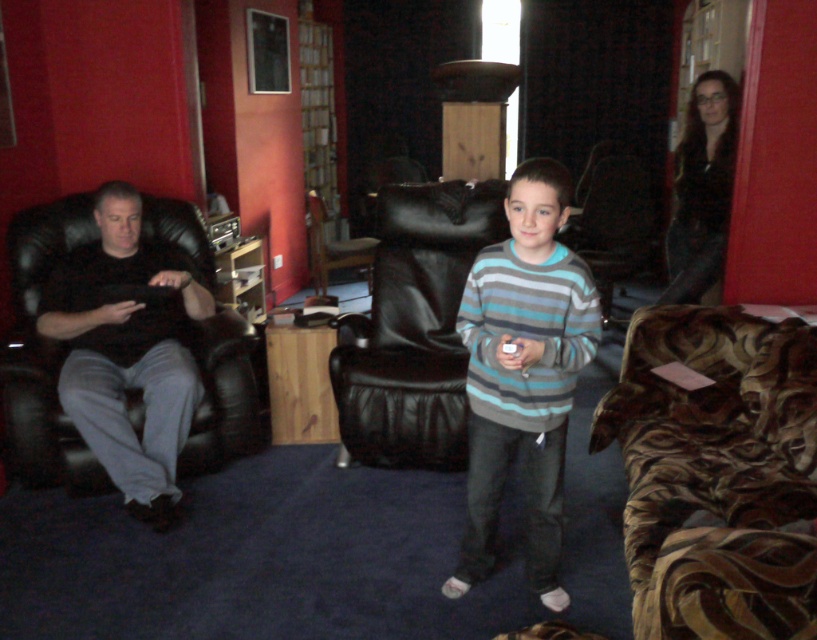
Question: Among these objects, which one is farthest from the camera?

Choices:
 (A) striped sweater at center
 (B) black leather chair at left
 (C) brown velvety couch at lower right
 (D) black leather chair at center

Answer: (D)

Question: Does striped sweater at center appear on the right side of black leather chair at left?

Choices:
 (A) no
 (B) yes

Answer: (B)

Question: Is black leather chair at left below black leather chair at center?

Choices:
 (A) no
 (B) yes

Answer: (B)

Question: Can you confirm if brown velvety couch at lower right is positioned to the right of black leather chair at left?

Choices:
 (A) no
 (B) yes

Answer: (B)

Question: Which object appears farthest from the camera in this image?

Choices:
 (A) brown velvety couch at lower right
 (B) black leather chair at center
 (C) black leather chair at left
 (D) striped sweater at center

Answer: (B)

Question: Which point is farther from the camera taking this photo?

Choices:
 (A) (371, 372)
 (B) (322, 236)
 (C) (552, 552)

Answer: (B)